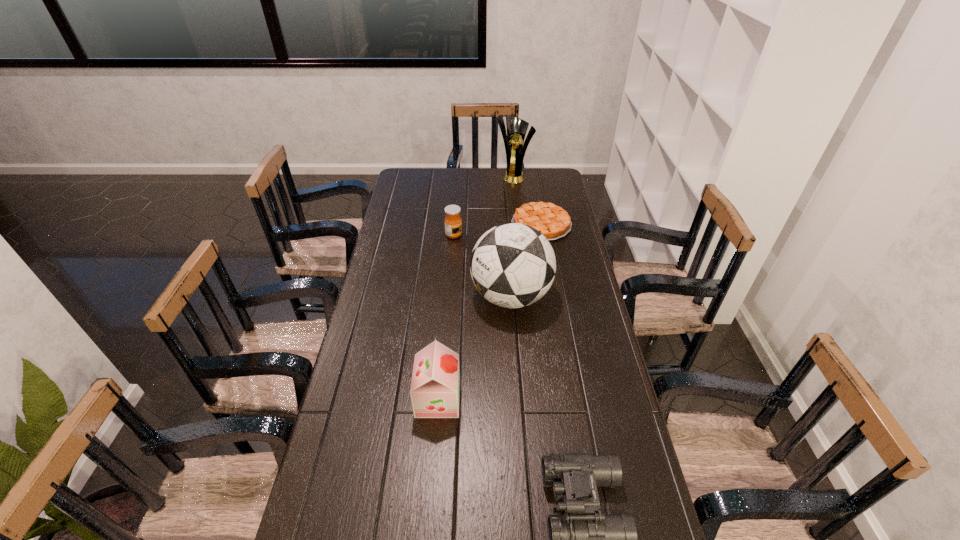
Find the location of a particular element. The image size is (960, 540). vacant space that satisfies the following two spatial constraints: 1. at the front of the shortest object, where the globe is visible; 2. on the left side of the award is located at coordinates (519, 225).

Image resolution: width=960 pixels, height=540 pixels. Identify the location of vacant space that satisfies the following two spatial constraints: 1. at the front of the award, where the globe is visible; 2. on the front-facing side of the honey. (520, 235).